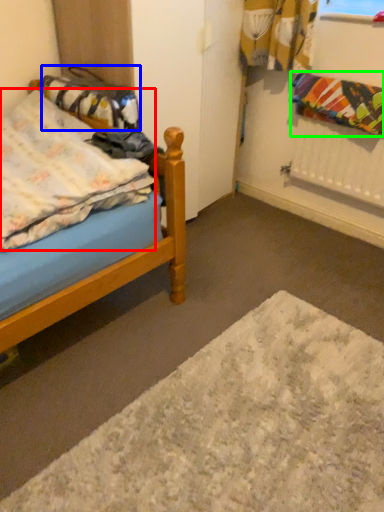
Question: Based on their relative distances, which object is farther from blanket (highlighted by a red box)? Choose from material (highlighted by a blue box) and blanket (highlighted by a green box).

Choices:
 (A) material
 (B) blanket

Answer: (B)